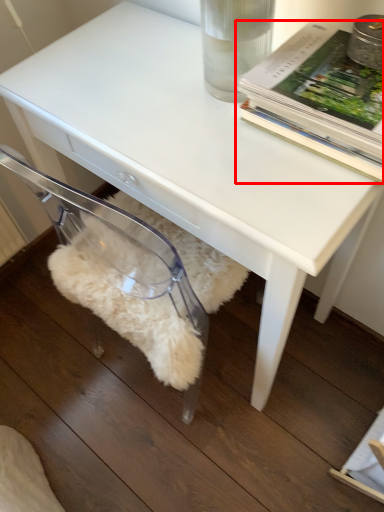
Question: From the image, what is the correct spatial relationship of book (annotated by the red box) in relation to swivel chair?

Choices:
 (A) right
 (B) left

Answer: (A)